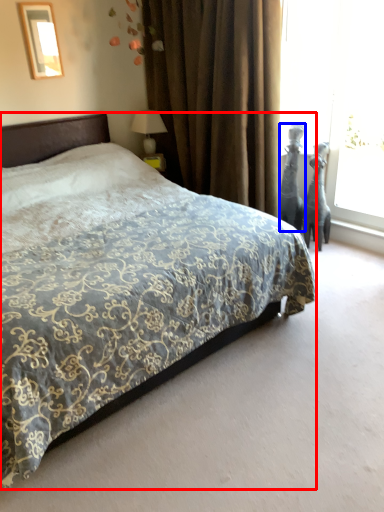
Question: Which of the following is the farthest to the observer, bed (highlighted by a red box) or sculpture (highlighted by a blue box)?

Choices:
 (A) bed
 (B) sculpture

Answer: (B)